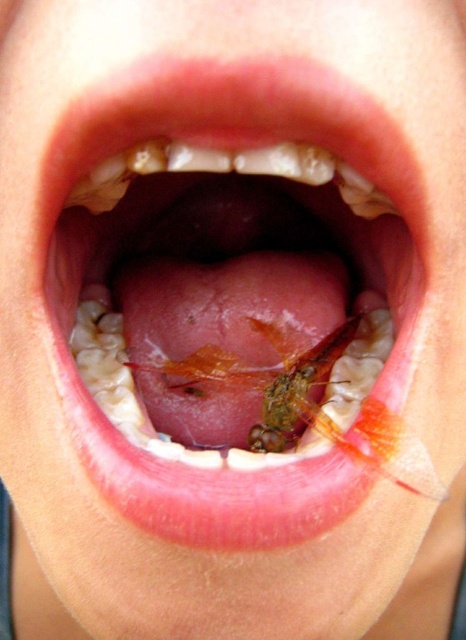
Question: Does pink flesh tongue at center appear on the right side of translucent orange insect at center?

Choices:
 (A) no
 (B) yes

Answer: (A)

Question: Which object is closer to the camera taking this photo?

Choices:
 (A) translucent orange insect at center
 (B) pink flesh tongue at center

Answer: (B)

Question: Is pink flesh tongue at center thinner than translucent orange insect at center?

Choices:
 (A) no
 (B) yes

Answer: (A)

Question: Is pink flesh tongue at center below translucent orange insect at center?

Choices:
 (A) no
 (B) yes

Answer: (A)